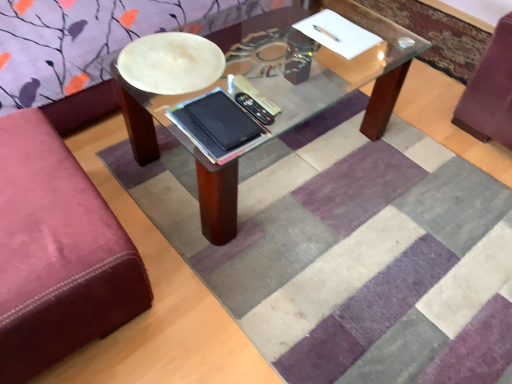
You are a GUI agent. You are given a task and a screenshot of the screen. Output one action in this format:
    pyautogui.click(x=<x>, y=<y>)
    Task: Click on the black matte tablet at center
    Image resolution: width=512 pixels, height=384 pixels.
    Given the screenshot: What is the action you would take?
    pyautogui.click(x=223, y=120)

Measure the distance between point (36, 308) and camera.

Point (36, 308) is 3.49 feet from camera.

The width and height of the screenshot is (512, 384). I want to click on striped rug at center, so click(x=343, y=250).

This screenshot has width=512, height=384. Find the location of `black matte tablet at center`. black matte tablet at center is located at coordinates (223, 120).

Between black matte tablet at center and striped rug at center, which one has more height?

Standing taller between the two is striped rug at center.

In the scene shown: Choose the correct answer: Is black matte tablet at center inside striped rug at center or outside it?

black matte tablet at center is not enclosed by striped rug at center.

Is black matte tablet at center further to camera compared to striped rug at center?

Yes, it is.

Is black matte tablet at center smaller than striped rug at center?

Correct, black matte tablet at center occupies less space than striped rug at center.

Would you say velvet maroon ottoman at left is outside striped rug at center?

Yes, velvet maroon ottoman at left is outside of striped rug at center.

Based on the photo, does velvet maroon ottoman at left have a larger size compared to striped rug at center?

Yes, velvet maroon ottoman at left is bigger than striped rug at center.

Does velvet maroon ottoman at left turn towards striped rug at center?

Yes.

Does striped rug at center have a larger size compared to velvet maroon ottoman at left?

No.

Would you say striped rug at center is inside or outside velvet maroon ottoman at left?

striped rug at center is spatially situated outside velvet maroon ottoman at left.

Which object is positioned more to the right, striped rug at center or velvet maroon ottoman at left?

striped rug at center is more to the right.

Which object is wider, striped rug at center or velvet maroon ottoman at left?

Wider between the two is striped rug at center.

From the image's perspective, would you say striped rug at center is positioned over black matte tablet at center?

No, from the image's perspective, striped rug at center is not above black matte tablet at center.

From a real-world perspective, does striped rug at center sit lower than black matte tablet at center?

Yes, from a real-world perspective, striped rug at center is below black matte tablet at center.

The width and height of the screenshot is (512, 384). Find the location of `mat below the black matte tablet at center (from a real-world perspective)`. mat below the black matte tablet at center (from a real-world perspective) is located at coordinates (343, 250).

Between point (358, 326) and point (232, 142), which one is positioned behind?

Positioned behind is point (358, 326).

Where is `studio couch directly beneath the black matte tablet at center (from a real-world perspective)`? This screenshot has height=384, width=512. studio couch directly beneath the black matte tablet at center (from a real-world perspective) is located at coordinates tap(57, 253).

Is black matte tablet at center beside velvet maroon ottoman at left?

No, black matte tablet at center is not next to velvet maroon ottoman at left.

Is velvet maroon ottoman at left surrounded by black matte tablet at center?

No, velvet maroon ottoman at left is not a part of black matte tablet at center.

How many degrees apart are the facing directions of black matte tablet at center and velvet maroon ottoman at left?

black matte tablet at center and velvet maroon ottoman at left are facing 90.2 degrees away from each other.

Is velvet maroon ottoman at left positioned with its back to black matte tablet at center?

That's not correct — velvet maroon ottoman at left is not looking away from black matte tablet at center.

Is velvet maroon ottoman at left thinner than black matte tablet at center?

In fact, velvet maroon ottoman at left might be wider than black matte tablet at center.

From the picture: Considering the sizes of objects velvet maroon ottoman at left and black matte tablet at center in the image provided, who is shorter, velvet maroon ottoman at left or black matte tablet at center?

black matte tablet at center.

Does point (50, 166) appear closer or farther from the camera than point (224, 109)?

Point (50, 166) is closer to the camera than point (224, 109).

Where is `mat on the right of black matte tablet at center`? The image size is (512, 384). mat on the right of black matte tablet at center is located at coordinates (343, 250).

What are the coordinates of `studio couch that is below the striped rug at center (from the image's perspective)` in the screenshot? It's located at (57, 253).

Looking at the image, which one is located further to black matte tablet at center, velvet maroon ottoman at left or striped rug at center?

Among the two, striped rug at center is located further to black matte tablet at center.

From the image, which object appears to be farther from velvet maroon ottoman at left, striped rug at center or black matte tablet at center?

striped rug at center is positioned further to the anchor velvet maroon ottoman at left.

From the image, which object appears to be farther from striped rug at center, black matte tablet at center or velvet maroon ottoman at left?

black matte tablet at center lies further to striped rug at center than the other object.

Estimate the real-world distances between objects in this image. Which object is further from velvet maroon ottoman at left, black matte tablet at center or striped rug at center?

Based on the image, striped rug at center appears to be further to velvet maroon ottoman at left.

Based on the photo, based on their spatial positions, is striped rug at center or velvet maroon ottoman at left further from black matte tablet at center?

The object further to black matte tablet at center is striped rug at center.

Considering their positions, is velvet maroon ottoman at left positioned further to striped rug at center than black matte tablet at center?

black matte tablet at center is positioned further to the anchor striped rug at center.

This screenshot has height=384, width=512. What are the coordinates of `tablet computer between velvet maroon ottoman at left and striped rug at center from left to right` in the screenshot? It's located at (223, 120).